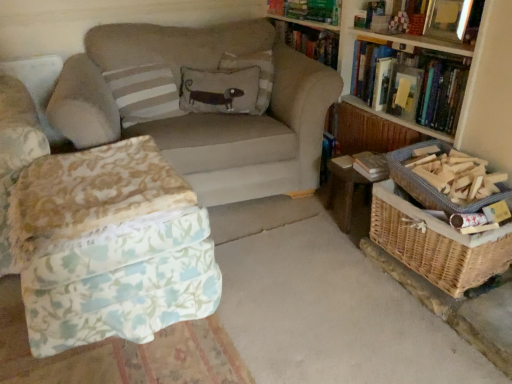
Question: Does point (296, 14) appear closer or farther from the camera than point (214, 31)?

Choices:
 (A) closer
 (B) farther

Answer: (A)

Question: Looking at their shapes, would you say hardcover book at upper center, which is counted as the first book, starting from the top, is wider or thinner than beige fabric couch at center?

Choices:
 (A) wide
 (B) thin

Answer: (B)

Question: Which is nearer to the beige fabric couch at center?

Choices:
 (A) hardcover book at upper right, acting as the 2th book starting from the bottom
 (B) hardcover book at upper right, positioned as the third book in top-to-bottom order
 (C) hardcover book at right
 (D) woven wicker basket at right, which is the 2th basket in top-to-bottom order
 (E) beige fabric pillow with dog design at center, arranged as the first pillow when viewed from the right

Answer: (E)

Question: Which object is positioned closest to the white striped pillow at upper left, the third pillow from the right?

Choices:
 (A) wooden bookcase at upper right
 (B) woven wicker basket at lower right
 (C) beige fabric couch at center
 (D) woven wood table at lower right
 (E) woven wicker basket at right, which is the 2th basket in top-to-bottom order

Answer: (C)